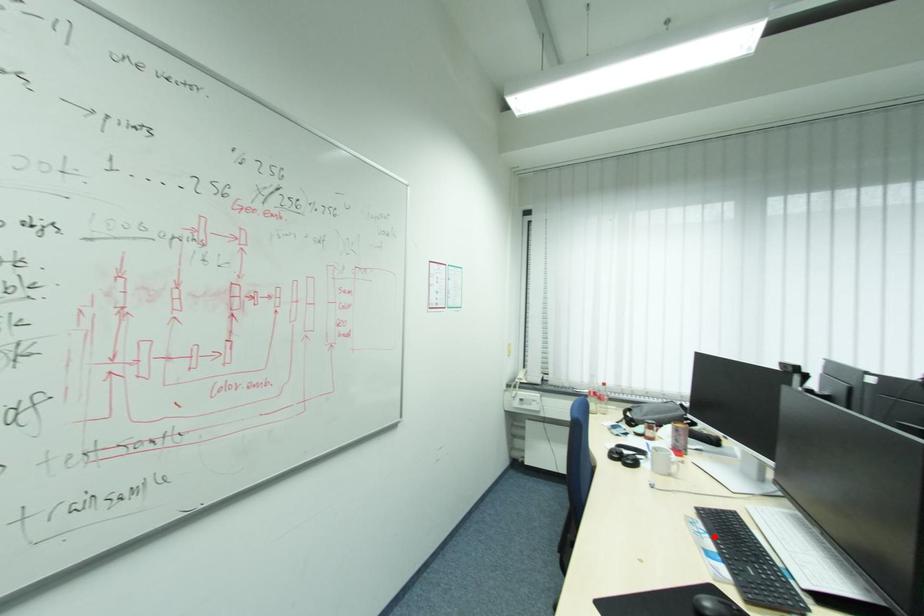
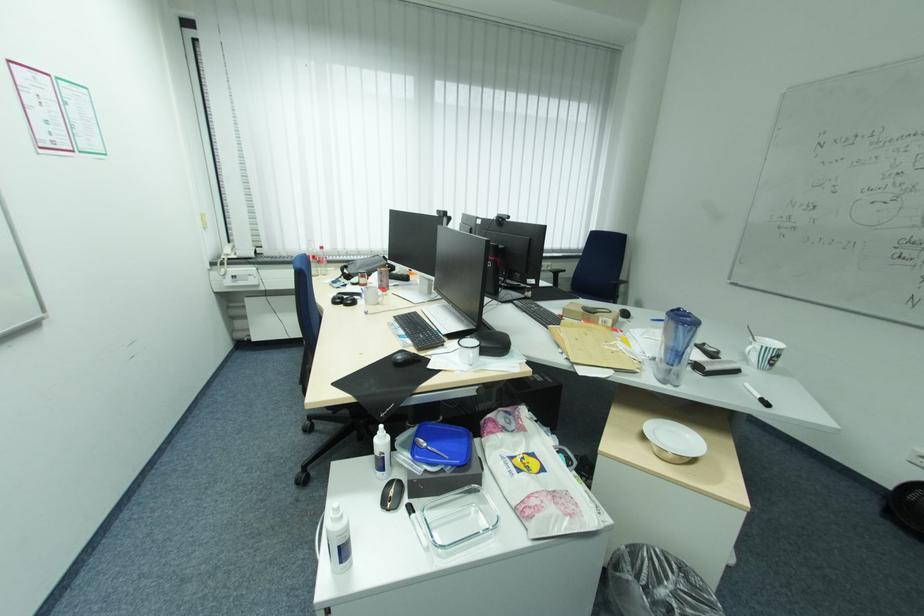
In the second image, find the point that corresponds to the highlighted location in the first image.

(407, 329)